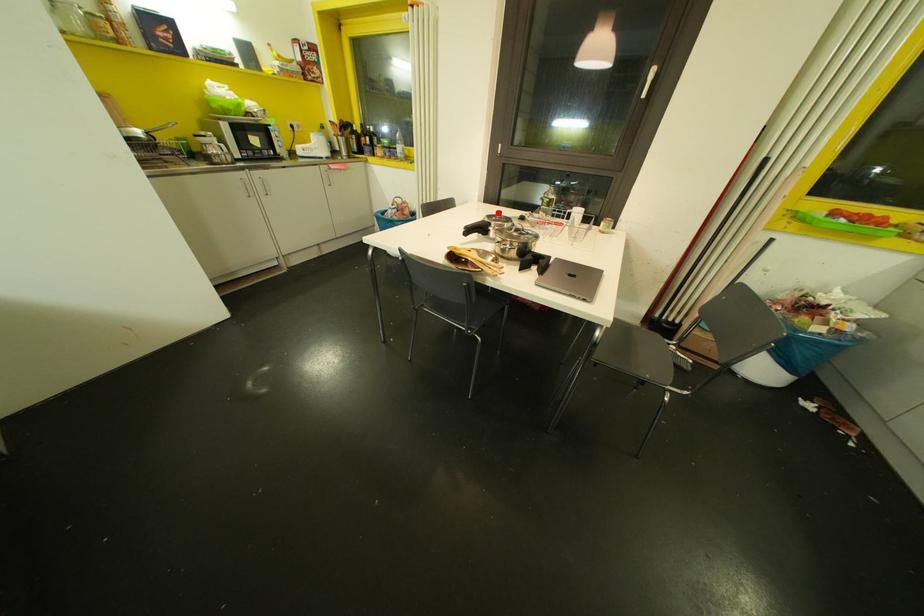
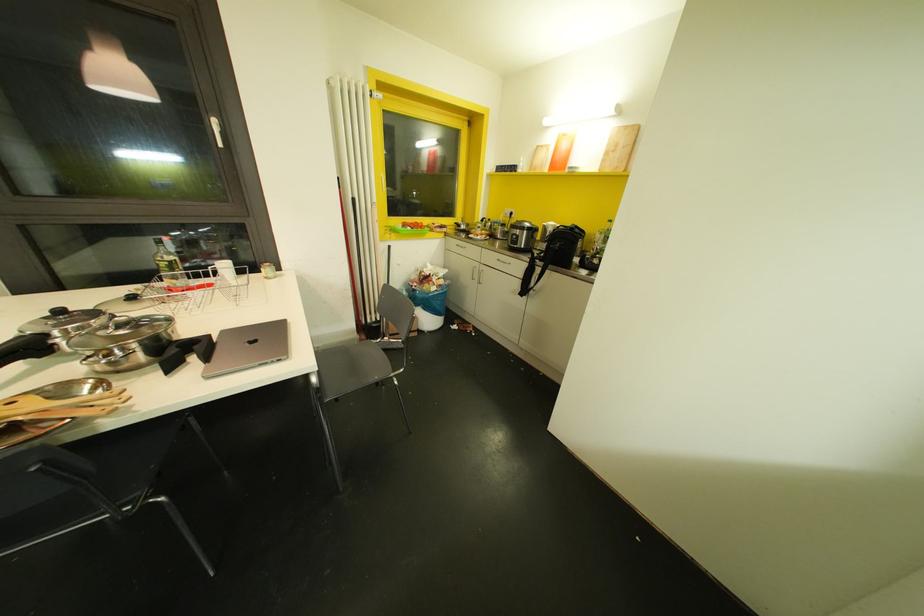
Find the pixel in the second image that matches the highlighted location in the first image.

(59, 310)